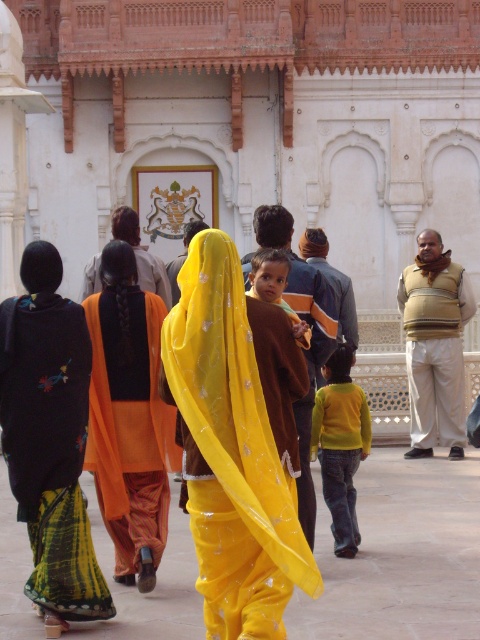
You are a photographer standing at the entrance of the building. You want to take a photo that includes both the yellow satin sari at center and the beige textured vest at center. Given that your camera has a maximum focus range of 15 meters, will you be able to capture both subjects in focus without moving closer?

The yellow satin sari at center and beige textured vest at center are 17.20 meters apart from each other. Since the camera can only focus up to 15 meters, the distance between them exceeds the focus range. Therefore, you cannot capture both in focus without moving closer.

You are standing in the courtyard and want to walk towards the building entrance. There are two points marked in the image, point A at coordinates point (225, 477) and point B at coordinates point (50, 381). Which point should you head towards to get closer to the entrance?

Point A at coordinates point (225, 477) is closer to the viewer than point B at coordinates point (50, 381), so heading towards point A would bring you closer to the entrance.

You are a photographer trying to capture a photo of the yellow satin sari at center and the matte brown shirt at center. From your current position, which one is positioned to the left side of the other?

The yellow satin sari at center is to the left of matte brown shirt at center.